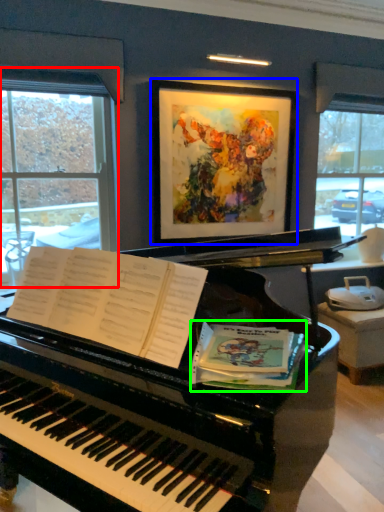
Question: Which object is the closest to the window (highlighted by a red box)? Choose among these: picture frame (highlighted by a blue box) or paperback book (highlighted by a green box).

Choices:
 (A) picture frame
 (B) paperback book

Answer: (A)